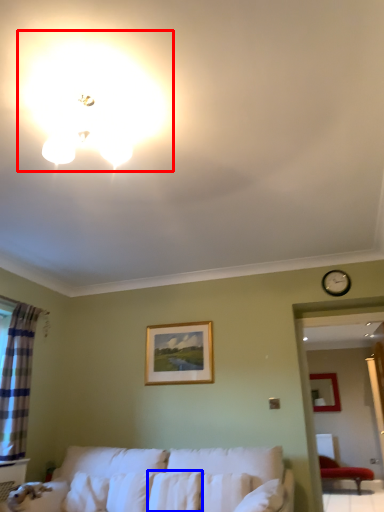
Question: Which object appears farthest to the camera in this image, lighting (highlighted by a red box) or pillow (highlighted by a blue box)?

Choices:
 (A) lighting
 (B) pillow

Answer: (B)